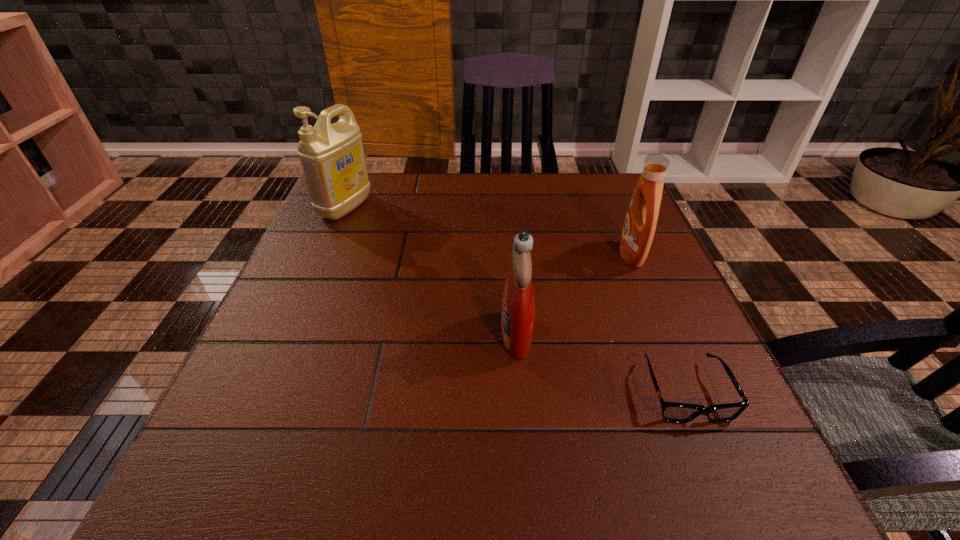
Locate an element on the screen. The width and height of the screenshot is (960, 540). the farthest object is located at coordinates pos(332,156).

Identify the location of the leftmost object. (332, 156).

The image size is (960, 540). I want to click on the rightmost detergent, so click(639, 228).

The image size is (960, 540). Find the location of `the second farthest object`. the second farthest object is located at coordinates (639, 228).

Where is `the nearest detergent`? the nearest detergent is located at coordinates (518, 305).

Find the location of a particular element. This screenshot has width=960, height=540. the second detergent from left to right is located at coordinates 518,305.

Where is `the shortest object`? The height and width of the screenshot is (540, 960). the shortest object is located at coordinates (673, 412).

What are the coordinates of `vacant space located 0.330m on the front of the farthest object` in the screenshot? It's located at (296, 322).

Locate an element on the screen. vacant area situated 0.090m on the front-facing side of the rightmost detergent is located at coordinates (581, 255).

Find the location of a particular element. This screenshot has width=960, height=540. vacant space positioned 0.260m on the front-facing side of the rightmost detergent is located at coordinates (507, 255).